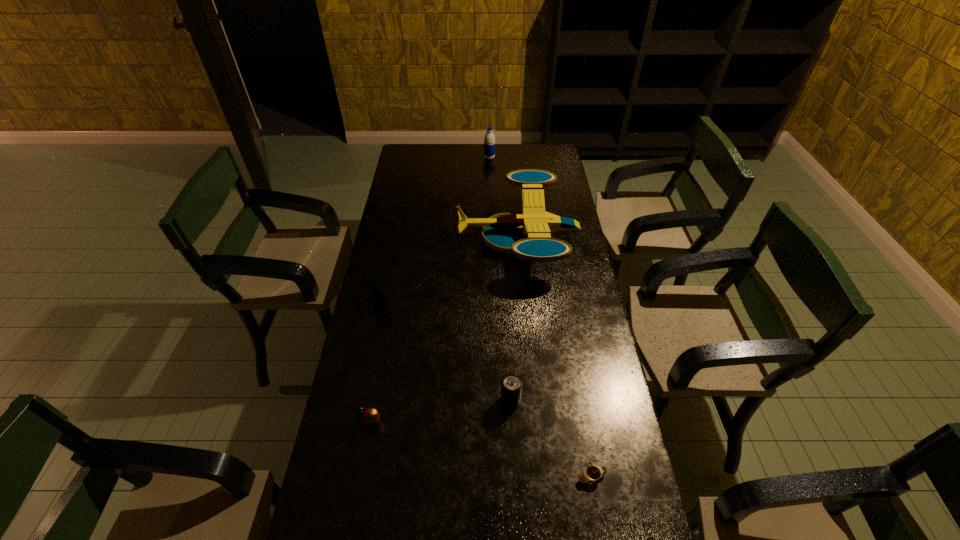
The width and height of the screenshot is (960, 540). What are the coordinates of `water bottle` in the screenshot? It's located at (489, 140).

The image size is (960, 540). Find the location of `the second farthest object`. the second farthest object is located at coordinates (527, 235).

Image resolution: width=960 pixels, height=540 pixels. Identify the location of the third farthest object. (376, 296).

Where is `pop soda`? pop soda is located at coordinates (511, 387).

Identify the location of the fifth farthest object. (366, 417).

The width and height of the screenshot is (960, 540). What are the coordinates of `the second shortest object` in the screenshot? It's located at (366, 417).

In order to click on the shortest object in this screenshot , I will do `click(592, 473)`.

The width and height of the screenshot is (960, 540). In order to click on watch in this screenshot , I will do `click(592, 473)`.

Find the location of a particular element. Image resolution: width=960 pixels, height=540 pixels. vacant space located 0.070m on the left of the farthest object is located at coordinates (470, 158).

Identify the location of vacant space situated at the cockpit of the second farthest object. This screenshot has width=960, height=540. (439, 239).